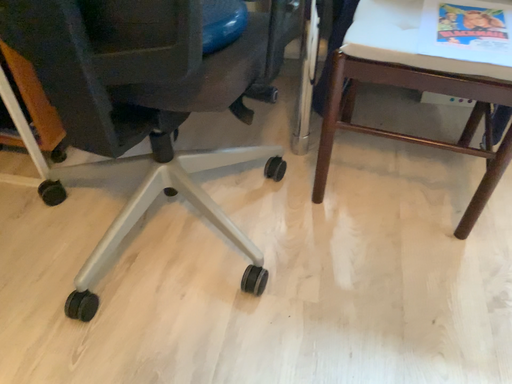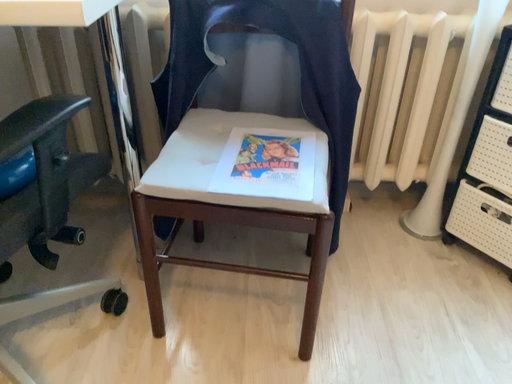
Question: Which way did the camera rotate in the video?

Choices:
 (A) rotated right
 (B) rotated left

Answer: (A)